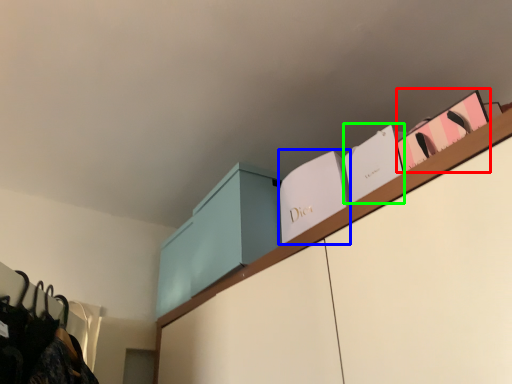
Question: Estimate the real-world distances between objects in this image. Which object is closer to book (highlighted by a red box), book (highlighted by a blue box) or book (highlighted by a green box)?

Choices:
 (A) book
 (B) book

Answer: (B)